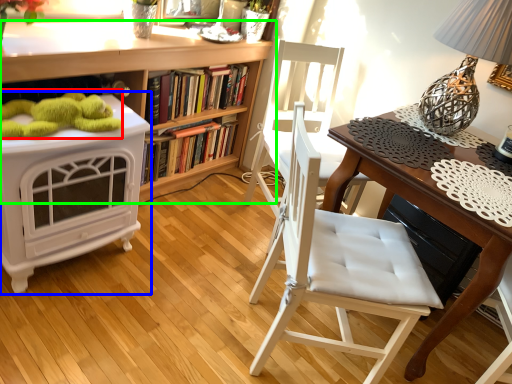
Question: Estimate the real-world distances between objects in this image. Which object is closer to toy (highlighted by a red box), vanity (highlighted by a blue box) or bookcase (highlighted by a green box)?

Choices:
 (A) vanity
 (B) bookcase

Answer: (A)